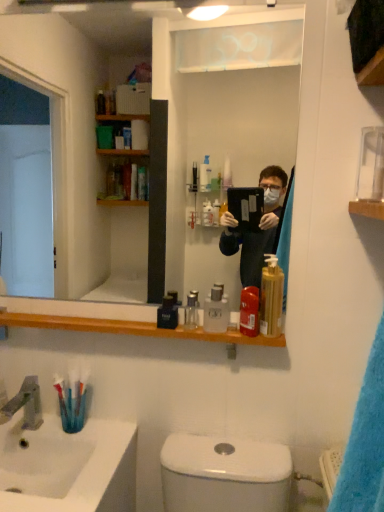
This screenshot has width=384, height=512. I want to click on vacant area that lies to the right of satin nickel faucet at sink left, so click(x=88, y=434).